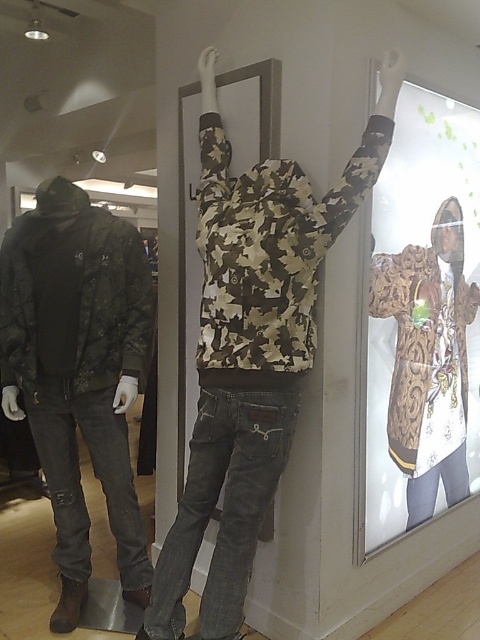
Who is positioned more to the left, camo-patterned sweatshirt at center or gold metallic jacket at upper right?

camo-patterned sweatshirt at center is more to the left.

Locate an element on the screen. camo-patterned sweatshirt at center is located at coordinates (252, 349).

Which is in front, point (192, 440) or point (457, 468)?

Point (192, 440) is more forward.

The image size is (480, 640). Find the location of `camo-patterned sweatshirt at center`. camo-patterned sweatshirt at center is located at coordinates (252, 349).

Based on the photo, does gold metallic jacket at upper right appear over camouflage fabric jacket at left?

Correct, gold metallic jacket at upper right is located above camouflage fabric jacket at left.

Does gold metallic jacket at upper right have a greater width compared to camouflage fabric jacket at left?

Yes.

Where is `gold metallic jacket at upper right`? Image resolution: width=480 pixels, height=640 pixels. gold metallic jacket at upper right is located at coordinates (422, 317).

Is camo-patterned sweatshirt at center shorter than camouflage fabric jacket at left?

No, camo-patterned sweatshirt at center is not shorter than camouflage fabric jacket at left.

The image size is (480, 640). Describe the element at coordinates (252, 349) in the screenshot. I see `camo-patterned sweatshirt at center` at that location.

Locate an element on the screen. camo-patterned sweatshirt at center is located at coordinates (252, 349).